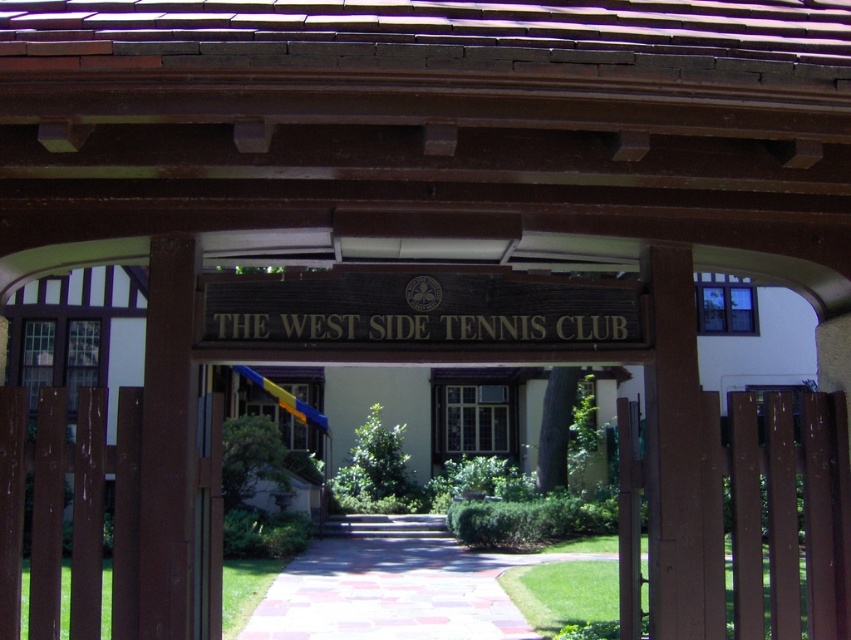
You are an architect designing a new sign for the entrance. The existing brown polished wood sign at center is currently narrower than the clear glass window at center. If you want the new sign to be wider than the window, how should you adjust its dimensions?

The brown polished wood sign at center is currently narrower than the clear glass window at center. To make the new sign wider than the window, you need to increase its width beyond the window clear glass window at center.

Looking at this image, you are standing at the entrance of The West Side Tennis Club and want to hang a new decorative wreath. The wreath is 1.2 meters in height. The brown polished wood sign at center is currently in the way. Can you hang the wreath above the clear glass window at center without moving the sign?

The brown polished wood sign at center is shorter than the clear glass window at center. Since the wreath is 1.2 meters tall, it might fit above the window if there is enough vertical space. However, since the sign is shorter than the window, it may not obstruct the area above the window. You can attempt to hang the wreath there without moving the sign.

You are a visitor approaching the entrance of The West Side Tennis Club. You notice the brown polished wood sign at center and the clear glass window at center. Which object is positioned higher relative to the other?

The brown polished wood sign at center is above the clear glass window at center, so it is positioned higher.